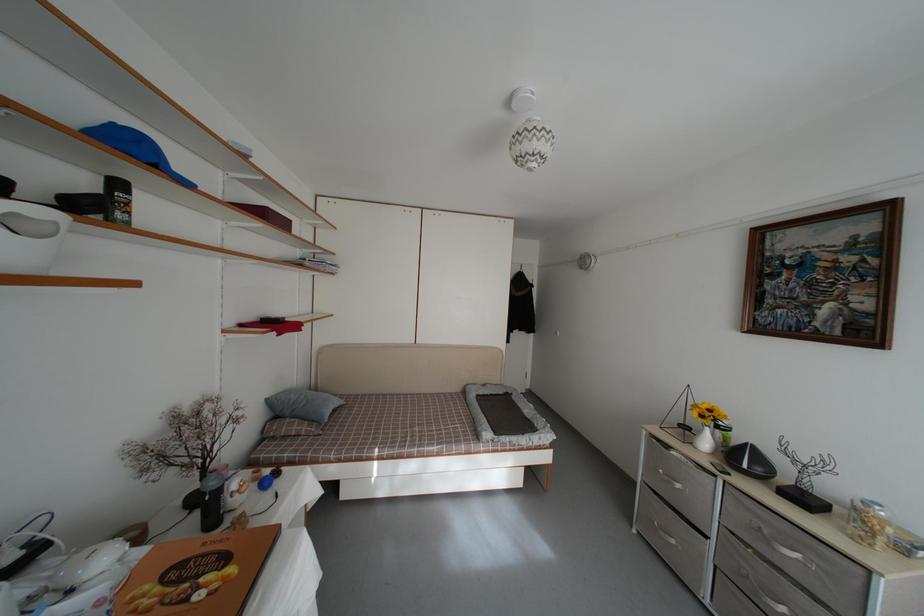
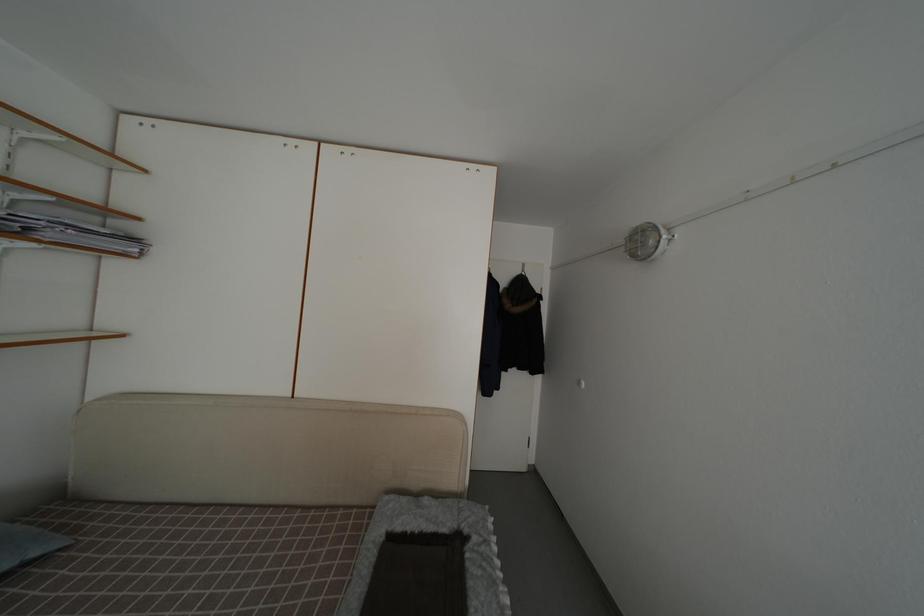
Which direction would the cameraman need to move to produce the second image?

The cameraman walked toward right, forward.